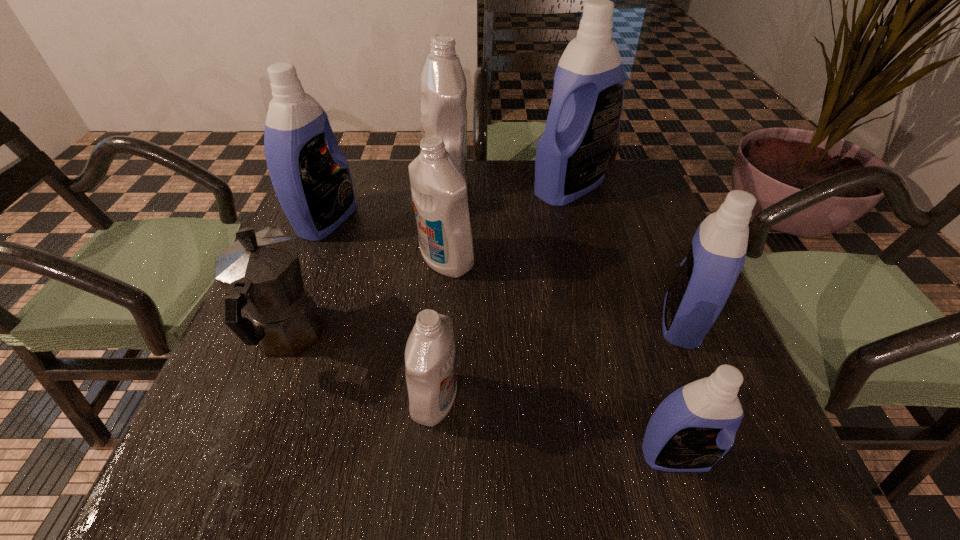
In the image, there is a desktop. Where is `vacant space at the left edge`? The width and height of the screenshot is (960, 540). vacant space at the left edge is located at coordinates (331, 249).

In the image, there is a desktop. Where is `free region at the right edge`? This screenshot has width=960, height=540. free region at the right edge is located at coordinates [x=632, y=218].

This screenshot has height=540, width=960. What are the coordinates of `free spot at the far right corner of the desktop` in the screenshot? It's located at (657, 204).

The image size is (960, 540). What are the coordinates of `vacant area between the tallest object and the second biggest white detergent` in the screenshot? It's located at (508, 223).

Find the location of a particular element. Image resolution: width=960 pixels, height=540 pixels. free space between the smallest white detergent and the biggest white detergent is located at coordinates (440, 291).

I want to click on free area in between the third farthest blue detergent and the second nearest white detergent, so click(564, 291).

Find the location of a particular element. The height and width of the screenshot is (540, 960). vacant point located between the biggest blue detergent and the second smallest white detergent is located at coordinates tap(508, 223).

At what (x,y) coordinates should I click in order to perform the action: click on unoccupied position between the second biggest white detergent and the second biggest blue detergent. Please return your answer as a coordinate pair (x, y). This screenshot has height=540, width=960. Looking at the image, I should click on (386, 240).

This screenshot has height=540, width=960. Find the location of `vacant region between the smallest blue detergent and the smallest white detergent`. vacant region between the smallest blue detergent and the smallest white detergent is located at coordinates (555, 427).

At what (x,y) coordinates should I click in order to perform the action: click on empty space that is in between the farthest white detergent and the nearest object. Please return your answer as a coordinate pair (x, y). Looking at the image, I should click on (561, 318).